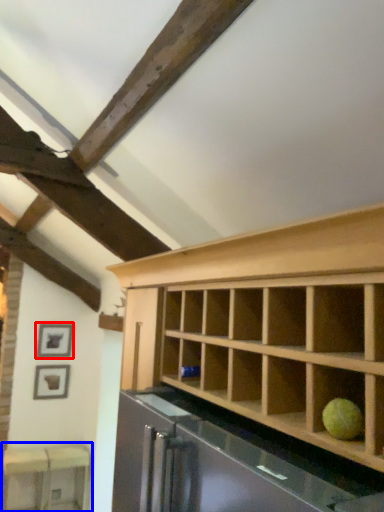
Question: Which object appears farthest to the camera in this image, picture frame (highlighted by a red box) or table (highlighted by a blue box)?

Choices:
 (A) picture frame
 (B) table

Answer: (A)